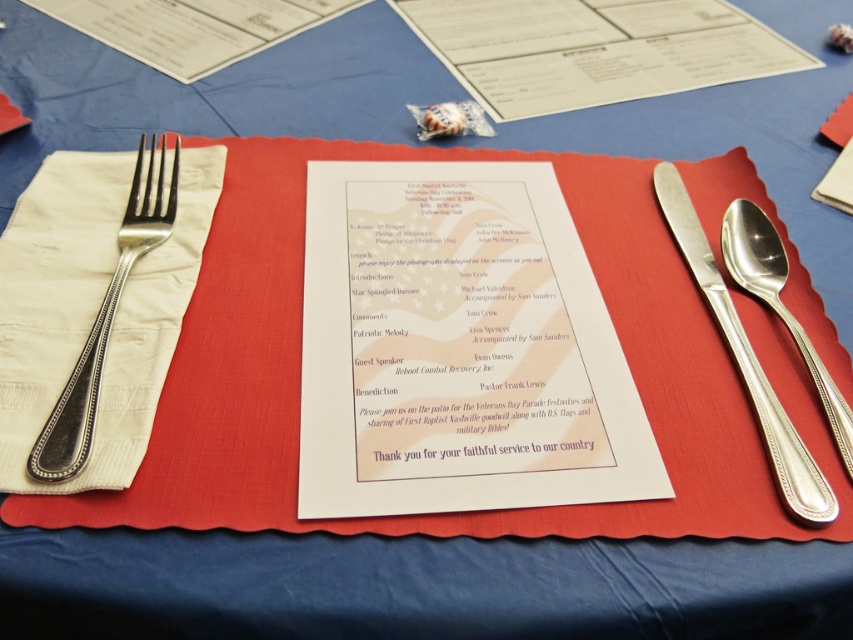
Image resolution: width=853 pixels, height=640 pixels. What do you see at coordinates (457, 348) in the screenshot?
I see `white paper menu at center` at bounding box center [457, 348].

Is point (560, 196) positioned after point (158, 224)?

Yes, point (560, 196) is farther from viewer.

Identify the location of white paper menu at center. (457, 348).

Is point (316, 298) behind point (851, 432)?

Yes, it is behind point (851, 432).

Does point (508, 321) come in front of point (838, 420)?

No, (508, 321) is behind (838, 420).

Which is in front, point (624, 477) or point (767, 221)?

Point (624, 477) is more forward.

Where is `white paper menu at center`? The image size is (853, 640). white paper menu at center is located at coordinates (457, 348).

Consider the image. Is silver metallic knife and spoon at right smaller than silver/glossy spoon at right?

No, silver metallic knife and spoon at right is not smaller than silver/glossy spoon at right.

Between silver metallic knife and spoon at right and silver/glossy spoon at right, which one has more height?

Standing taller between the two is silver metallic knife and spoon at right.

Measure the distance between silver metallic knife and spoon at right and camera.

The distance of silver metallic knife and spoon at right from camera is 39.71 centimeters.

The image size is (853, 640). I want to click on silver metallic knife and spoon at right, so [x=746, y=362].